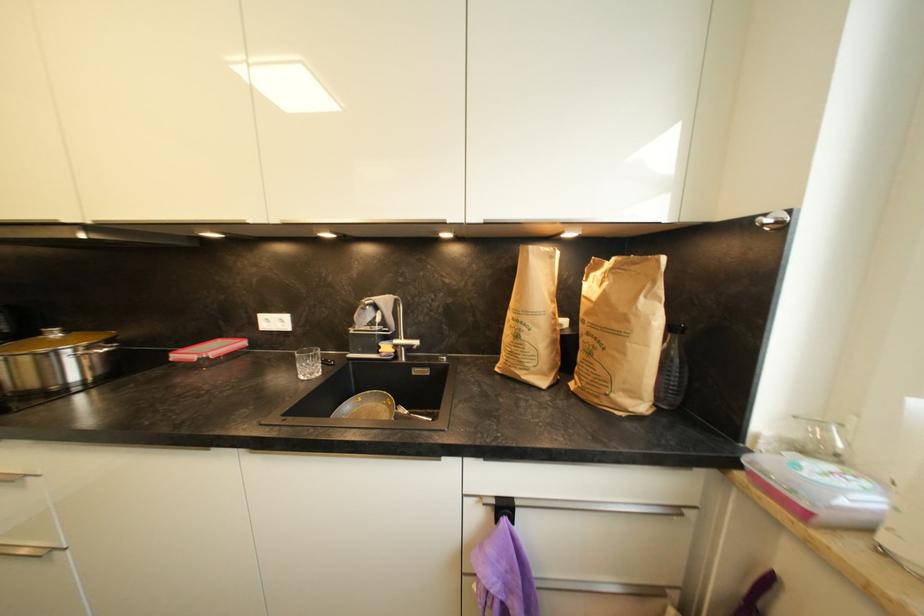
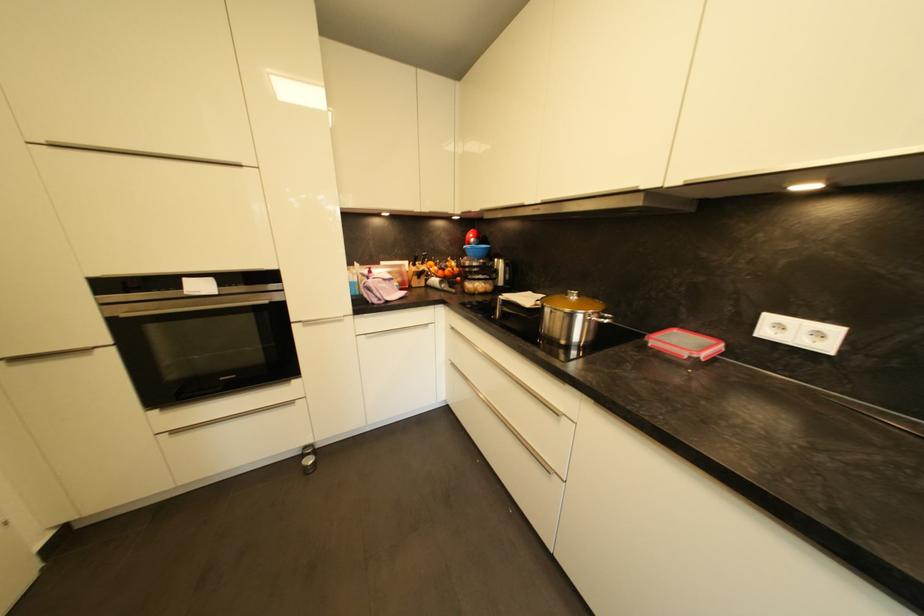
Question: The first image is from the beginning of the video and the second image is from the end. How did the camera likely rotate when shooting the video?

Choices:
 (A) Left
 (B) Right
 (C) Up
 (D) Down

Answer: (A)